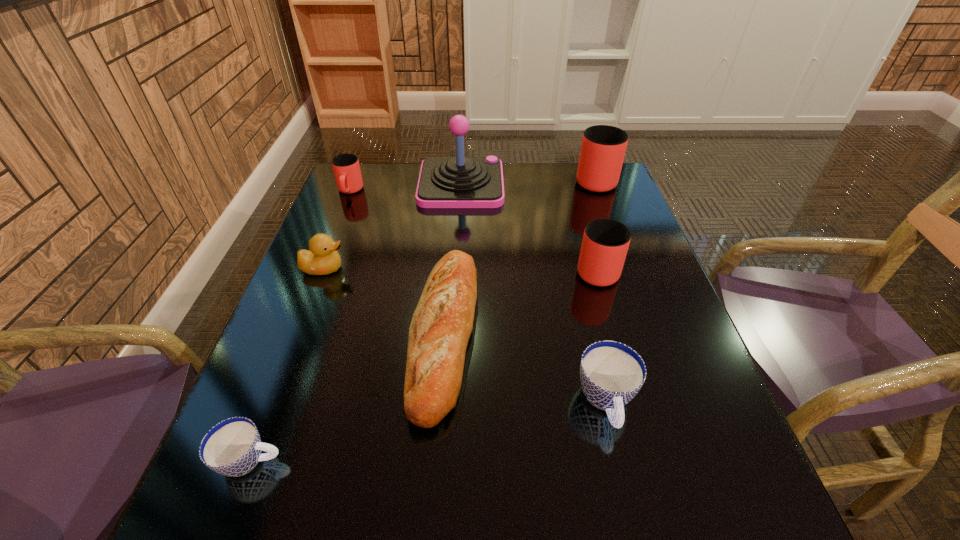
The height and width of the screenshot is (540, 960). I want to click on pink joystick, so click(x=444, y=182).

The width and height of the screenshot is (960, 540). Identify the location of joystick. (444, 182).

Find the location of a particular element. The height and width of the screenshot is (540, 960). the biggest pink cup is located at coordinates (603, 147).

The height and width of the screenshot is (540, 960). What are the coordinates of `the tallest cup` in the screenshot? It's located at (603, 147).

The image size is (960, 540). What are the coordinates of `the fourth shortest cup` in the screenshot? It's located at (605, 243).

This screenshot has height=540, width=960. I want to click on the third nearest cup, so click(605, 243).

Identify the location of duckling. point(323,259).

This screenshot has height=540, width=960. In order to click on the leftmost pink cup in this screenshot , I will do `click(346, 167)`.

The height and width of the screenshot is (540, 960). I want to click on baguet, so click(x=442, y=323).

You are a GUI agent. You are given a task and a screenshot of the screen. Output one action in this format:
    pyautogui.click(x=<x>, y=<y>)
    Task: Click on the bigger blue cup
    
    Given the screenshot: What is the action you would take?
    pyautogui.click(x=611, y=373)